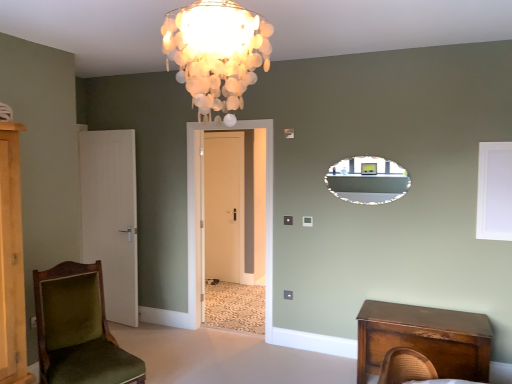
Question: Is white matte window screen at upper right not inside matte black mirror at upper center?

Choices:
 (A) yes
 (B) no

Answer: (A)

Question: Is white matte window screen at upper right positioned before matte black mirror at upper center?

Choices:
 (A) no
 (B) yes

Answer: (B)

Question: Considering the relative sizes of white matte window screen at upper right and matte black mirror at upper center in the image provided, is white matte window screen at upper right bigger than matte black mirror at upper center?

Choices:
 (A) no
 (B) yes

Answer: (A)

Question: From a real-world perspective, is white matte window screen at upper right over matte black mirror at upper center?

Choices:
 (A) yes
 (B) no

Answer: (B)

Question: Can matte black mirror at upper center be found inside white matte window screen at upper right?

Choices:
 (A) yes
 (B) no

Answer: (B)

Question: Is point (123, 200) positioned closer to the camera than point (221, 125)?

Choices:
 (A) closer
 (B) farther

Answer: (B)

Question: Is white matte door at left, which ranks as the 2th door in back-to-front order, wider or thinner than white matte door at center, the third door positioned from the left?

Choices:
 (A) thin
 (B) wide

Answer: (A)

Question: Would you say white matte door at left, which ranks as the 2th door in back-to-front order, is inside or outside white matte door at center, the 1th door viewed from the front?

Choices:
 (A) inside
 (B) outside

Answer: (B)

Question: Considering the positions of white matte door at left, which ranks as the 2th door in back-to-front order, and white matte door at center, marked as the 1th door in a right-to-left arrangement, in the image, is white matte door at left, which ranks as the 2th door in back-to-front order, bigger or smaller than white matte door at center, marked as the 1th door in a right-to-left arrangement,?

Choices:
 (A) big
 (B) small

Answer: (B)

Question: Choose the correct answer: Is velvet green chair at lower left inside white matte window screen at upper right or outside it?

Choices:
 (A) inside
 (B) outside

Answer: (B)

Question: Looking at the image, does velvet green chair at lower left seem bigger or smaller compared to white matte window screen at upper right?

Choices:
 (A) big
 (B) small

Answer: (A)

Question: In the image, is velvet green chair at lower left positioned in front of or behind white matte window screen at upper right?

Choices:
 (A) behind
 (B) front

Answer: (B)

Question: From a real-world perspective, is velvet green chair at lower left physically located above or below white matte window screen at upper right?

Choices:
 (A) below
 (B) above

Answer: (A)

Question: In terms of width, does ivory shell chandelier at upper center look wider or thinner when compared to white matte door at center, which is the 3th door from back to front?

Choices:
 (A) wide
 (B) thin

Answer: (A)

Question: Is ivory shell chandelier at upper center to the left or to the right of white matte door at center, marked as the 1th door in a right-to-left arrangement, in the image?

Choices:
 (A) left
 (B) right

Answer: (B)